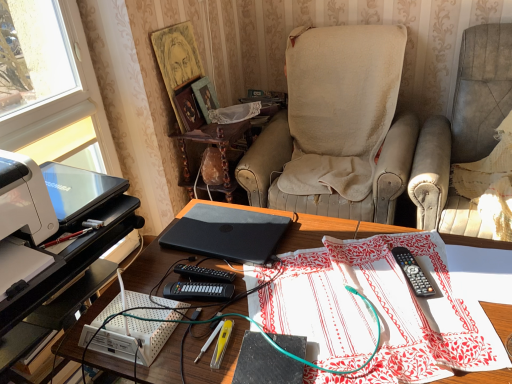
Question: In terms of width, does orange matte laptop at center, placed as the 2th laptop when sorted from left to right, look wider or thinner when compared to black plastic keyboard at center, acting as the 2th stationery starting from the right?

Choices:
 (A) thin
 (B) wide

Answer: (B)

Question: From a real-world perspective, is orange matte laptop at center, placed as the 2th laptop when sorted from left to right, positioned above or below black plastic keyboard at center, which appears as the first stationery when viewed from the left?

Choices:
 (A) above
 (B) below

Answer: (A)

Question: Estimate the real-world distances between objects in this image. Which object is farther from the black plastic keyboard at center, which appears as the first stationery when viewed from the left?

Choices:
 (A) black plastic remote control at center, the 1th stationery from the right
 (B) beige fabric chair at right, the 1th chair positioned from the right
 (C) orange matte laptop at center, the first laptop from the right
 (D) beige fabric chair at center, the 2th chair viewed from the right
 (E) white plastic printer at left

Answer: (B)

Question: Which object is the closest to the white printed fabric at center?

Choices:
 (A) black plastic remote control at center, acting as the 2th stationery starting from the left
 (B) matte black laptop at left, which is counted as the 2th laptop, starting from the right
 (C) matte black laptop at center
 (D) orange matte laptop at center, placed as the 2th laptop when sorted from left to right
 (E) beige fabric chair at right, which is the second chair from left to right

Answer: (A)